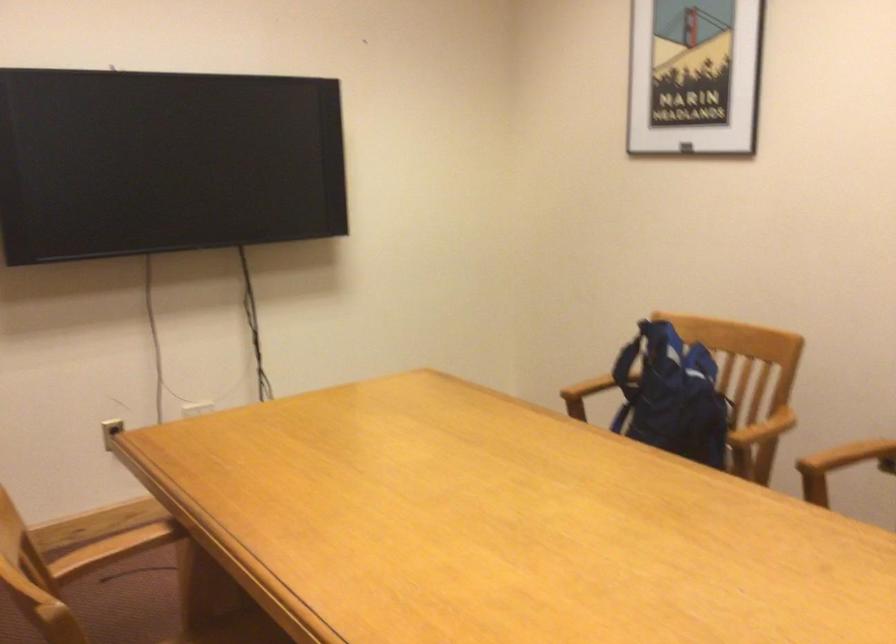
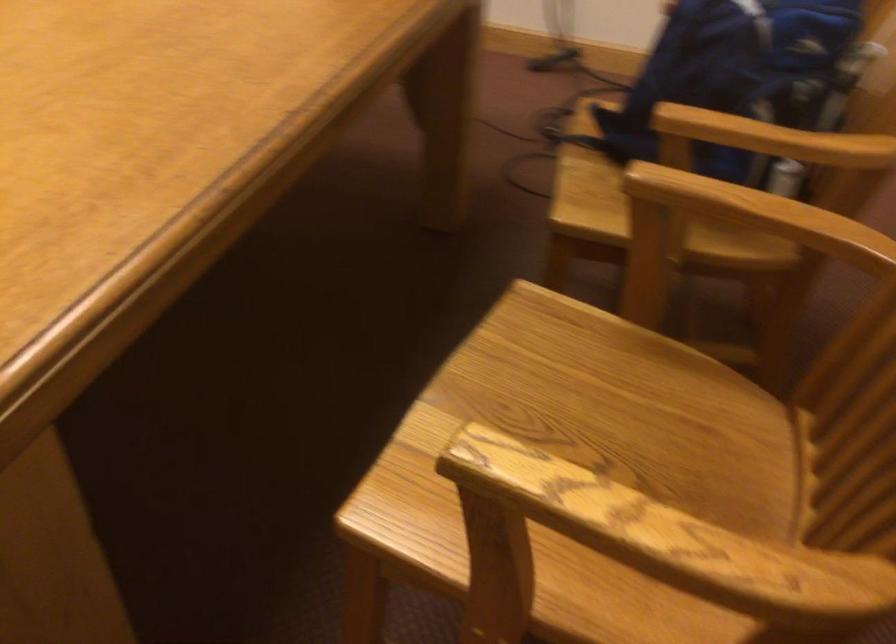
Where in the second image is the point corresponding to pixel 694 410 from the first image?

(736, 73)